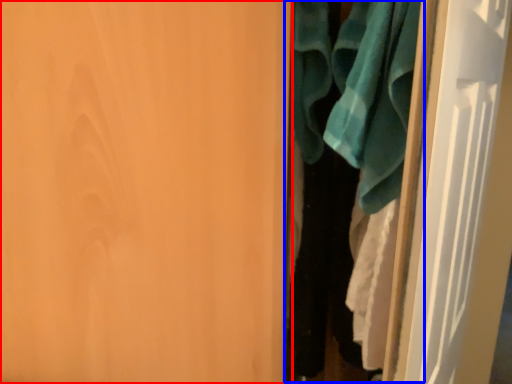
Question: Which object appears closest to the camera in this image, door (highlighted by a red box) or closet (highlighted by a blue box)?

Choices:
 (A) door
 (B) closet

Answer: (A)